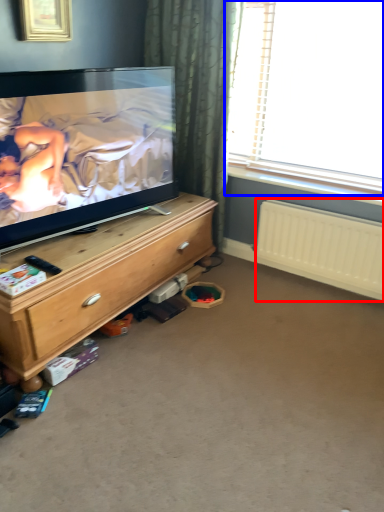
Question: Which object is closer to the camera taking this photo, radiator (highlighted by a red box) or window (highlighted by a blue box)?

Choices:
 (A) radiator
 (B) window

Answer: (B)